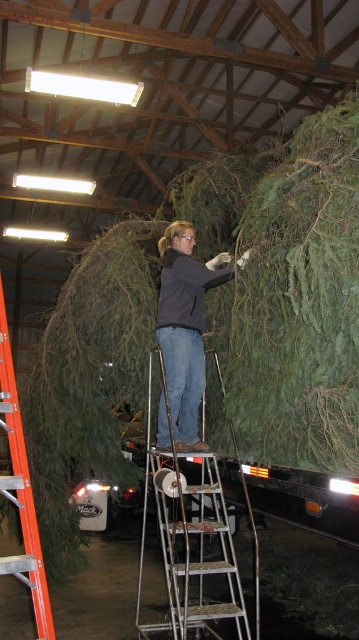
Between silver metallic ladder at center and orange plastic ladder at left, which one appears on the left side from the viewer's perspective?

orange plastic ladder at left

Is point (147, 426) positioned after point (48, 593)?

Yes, point (147, 426) is behind point (48, 593).

You are a GUI agent. You are given a task and a screenshot of the screen. Output one action in this format:
    pyautogui.click(x=<x>, y=<y>)
    Task: Click on the silver metallic ladder at center
    This screenshot has height=640, width=359.
    Given the screenshot: What is the action you would take?
    pyautogui.click(x=188, y=536)

Locate an element on the screen. Image resolution: width=359 pixels, height=640 pixels. dark gray sweater at center is located at coordinates (184, 326).

Between dark gray sweater at center and orange plastic ladder at left, which one has less height?

Standing shorter between the two is dark gray sweater at center.

Locate an element on the screen. This screenshot has height=640, width=359. dark gray sweater at center is located at coordinates (184, 326).

Between silver metallic ladder at center and dark gray sweater at center, which one is positioned higher?

dark gray sweater at center

Who is more distant from viewer, (208, 492) or (160, 417)?

Point (160, 417)

At what (x,y) coordinates should I click in order to perform the action: click on silver metallic ladder at center. Please return your answer as a coordinate pair (x, y). Looking at the image, I should click on (188, 536).